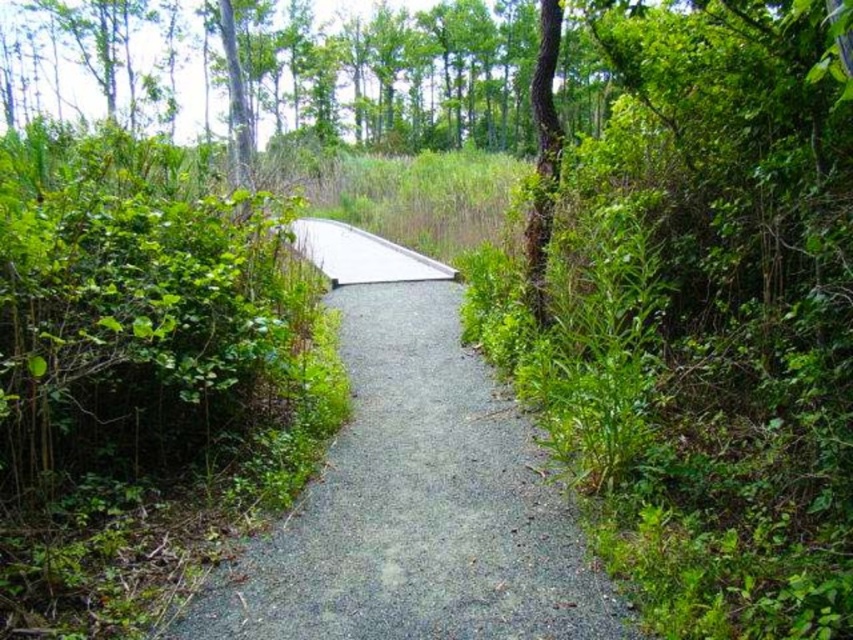
Question: Among these points, which one is nearest to the camera?

Choices:
 (A) (322, 589)
 (B) (540, 266)

Answer: (A)

Question: Is gravel path at center positioned behind brown rough bark tree at right?

Choices:
 (A) yes
 (B) no

Answer: (B)

Question: Can you confirm if gravel path at center is positioned to the left of brown rough bark tree at right?

Choices:
 (A) no
 (B) yes

Answer: (B)

Question: Can you confirm if gravel path at center is positioned above brown rough bark tree at right?

Choices:
 (A) yes
 (B) no

Answer: (B)